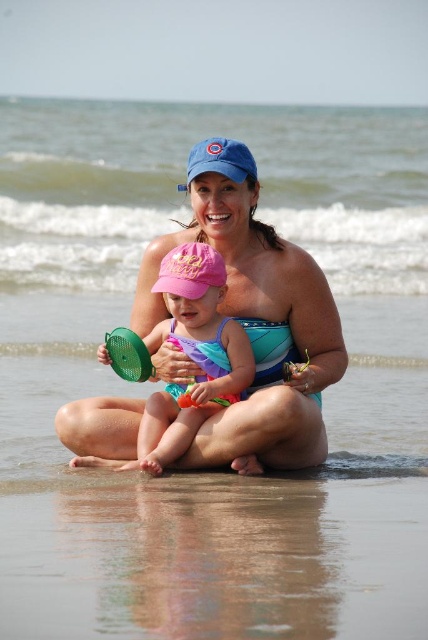
Is the position of matte blue swim cap at center more distant than that of pink fabric swimsuit at center?

Yes, it is.

Between matte blue swim cap at center and pink fabric swimsuit at center, which one appears on the right side from the viewer's perspective?

From the viewer's perspective, matte blue swim cap at center appears more on the right side.

Does point (238, 150) come in front of point (152, 394)?

No, it is not.

Locate an element on the screen. matte blue swim cap at center is located at coordinates (253, 280).